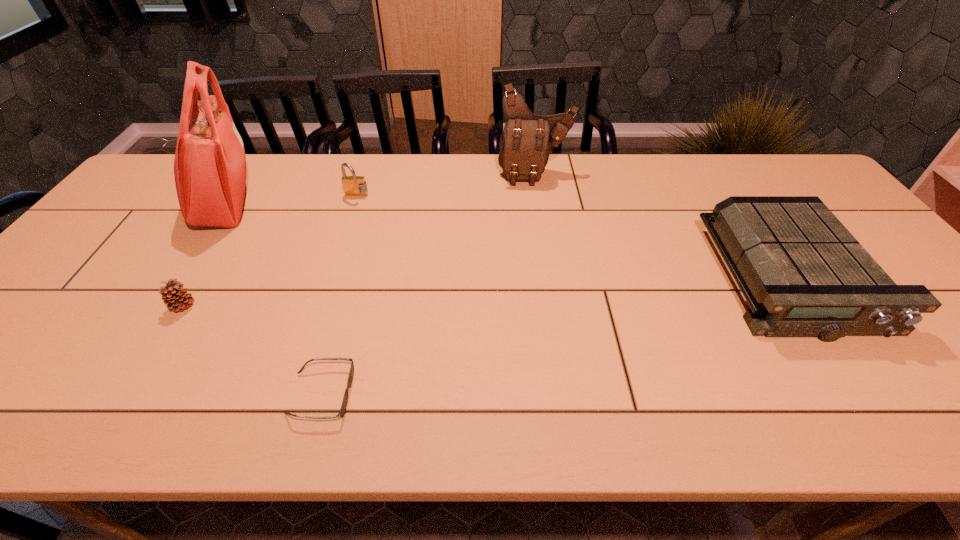
Identify the location of the tallest object. (210, 170).

In order to click on the second tallest object in this screenshot , I will do `click(527, 140)`.

Image resolution: width=960 pixels, height=540 pixels. I want to click on the fifth object from left to right, so click(x=527, y=140).

Locate an element on the screen. padlock is located at coordinates (353, 185).

The image size is (960, 540). Find the location of `the rightmost object`. the rightmost object is located at coordinates (803, 274).

Where is `pinecone`? pinecone is located at coordinates (174, 295).

The width and height of the screenshot is (960, 540). What are the coordinates of `the nearest object` in the screenshot? It's located at (342, 411).

Where is `sunglasses`? sunglasses is located at coordinates (342, 411).

Find the location of a particular element. The width and height of the screenshot is (960, 540). free spot located on the front-facing side of the handbag is located at coordinates click(329, 204).

At what (x,y) coordinates should I click in order to perform the action: click on vacant space located 0.290m on the front-facing side of the second tallest object. Please return your answer as a coordinate pair (x, y). This screenshot has width=960, height=540. Looking at the image, I should click on click(546, 248).